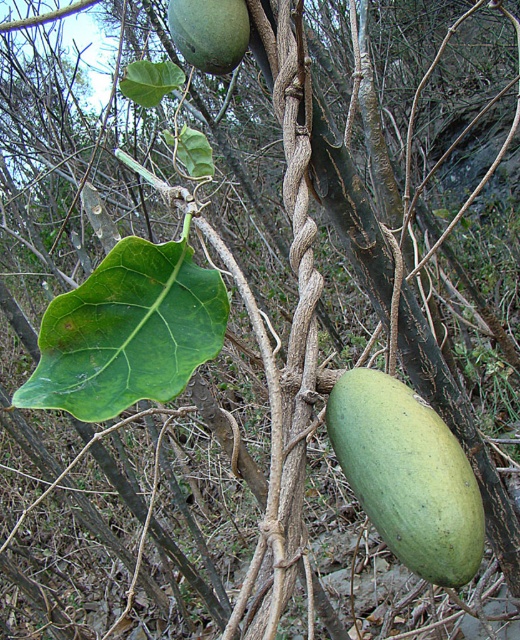
You are standing in front of the plant with large heart shaped leaves and fruits. There are two points marked in the image. One is at coordinate point (x=121, y=241) and the other is at point (x=451, y=492). Which point is closer to you?

Point (x=121, y=241) is further to the camera than point (x=451, y=492), so the point closer to you is point (x=451, y=492).